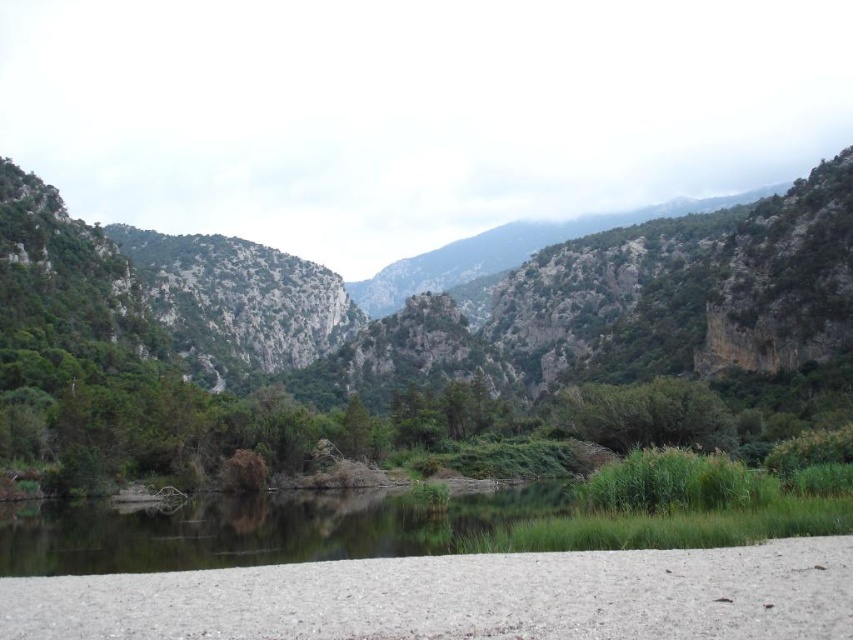
Looking at this image, you are standing on the white gravel at lower center and want to reach the clear water at center. Which direction should you move to get there?

The clear water at center is shorter than the white gravel at lower center, so you should move downward to reach it.

You are standing at the water edge in the serene landscape and want to reach the point marked as point (590, 561). However, there is an obstacle at point (598, 424). Can you walk directly to your destination without going around the obstacle?

Point (590, 561) is in front of point (598, 424), so you can walk directly to point (590, 561) without needing to go around the obstacle at point (598, 424).